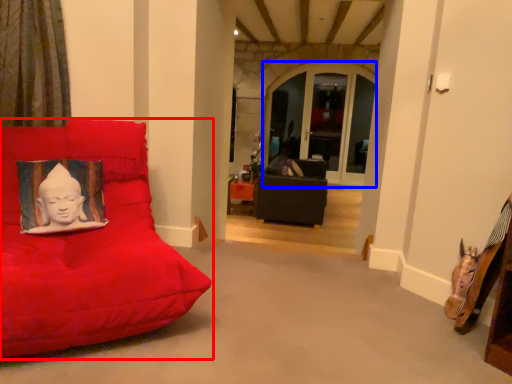
Question: Which object appears closest to the camera in this image, furniture (highlighted by a red box) or window (highlighted by a blue box)?

Choices:
 (A) furniture
 (B) window

Answer: (A)